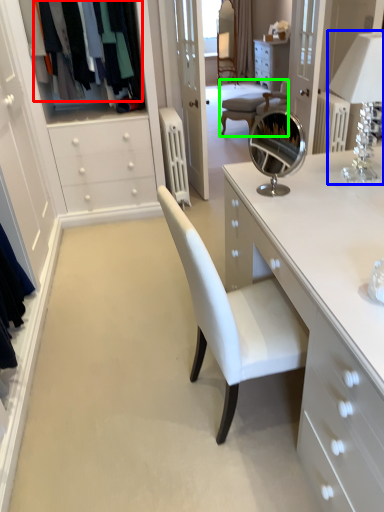
Question: Which is farther away from clothing (highlighted by a red box)? table lamp (highlighted by a blue box) or chair (highlighted by a green box)?

Choices:
 (A) table lamp
 (B) chair

Answer: (B)